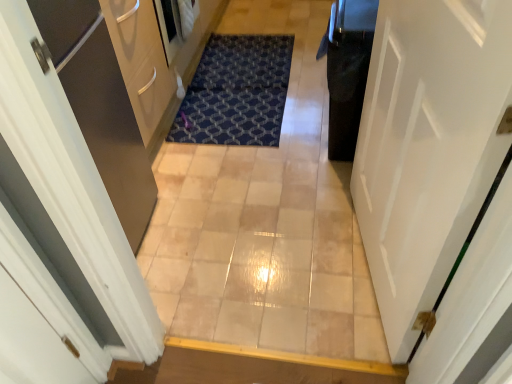
Locate an element on the screen. free spot to the left of black glossy trash can at right is located at coordinates point(289,153).